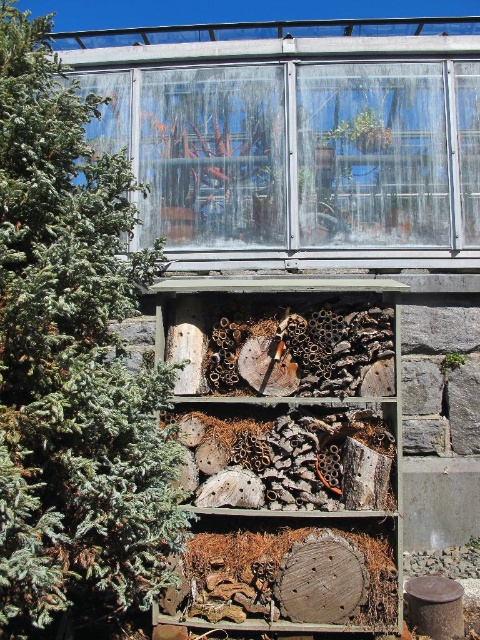
You are a gardener planning to place a new decorative item in the greenhouse. You have a small statue that needs to be placed near the smaller of the two objects. Which object should you choose between the green textured pine tree at left and the wooden beehive at center?

The wooden beehive at center is smaller than the green textured pine tree at left, so you should place the statue near the wooden beehive at center.

You are standing in the greenhouse and see two points marked in the image. The first point is at coordinates point (48, 504) and the second is at point (340, 499). Which point is nearer to you?

Point (48, 504) is closer to the camera than point (340, 499), so the first point is nearer to you.